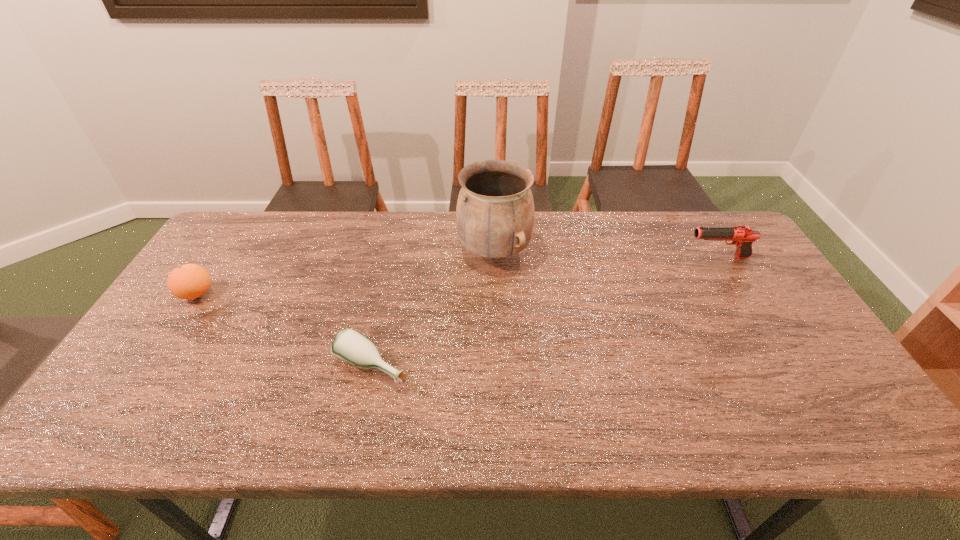
The image size is (960, 540). I want to click on vacant area between the orange and the tallest object, so click(x=346, y=273).

What are the coordinates of `free point between the rightmost object and the third object from left to right` in the screenshot? It's located at (606, 255).

The image size is (960, 540). Identify the location of blank region between the second object from right to left and the orange. (346, 273).

In order to click on free space between the gun and the urn in this screenshot , I will do `click(606, 255)`.

Locate an element on the screen. The width and height of the screenshot is (960, 540). free space between the second object from right to left and the third tallest object is located at coordinates (346, 273).

Locate an element on the screen. object identified as the third closest to the urn is located at coordinates coord(190,281).

Choose which object is the nearest neighbor to the second object from right to left. Please provide its 2D coordinates. Your answer should be formatted as a tuple, i.e. [(x, y)], where the tuple contains the x and y coordinates of a point satisfying the conditions above.

[(349, 345)]

Find the location of `free spot that satisfies the following two spatial constraints: 1. on the back side of the leftmost object; 2. on the left side of the tallest object`. free spot that satisfies the following two spatial constraints: 1. on the back side of the leftmost object; 2. on the left side of the tallest object is located at coordinates (225, 253).

Identify the location of free space that satisfies the following two spatial constraints: 1. on the back side of the urn; 2. on the left side of the nearest object. (397, 253).

Find the location of `blank space that satisfies the following two spatial constraints: 1. on the front side of the shortest object; 2. on the right side of the second shortest object`. blank space that satisfies the following two spatial constraints: 1. on the front side of the shortest object; 2. on the right side of the second shortest object is located at coordinates 150,366.